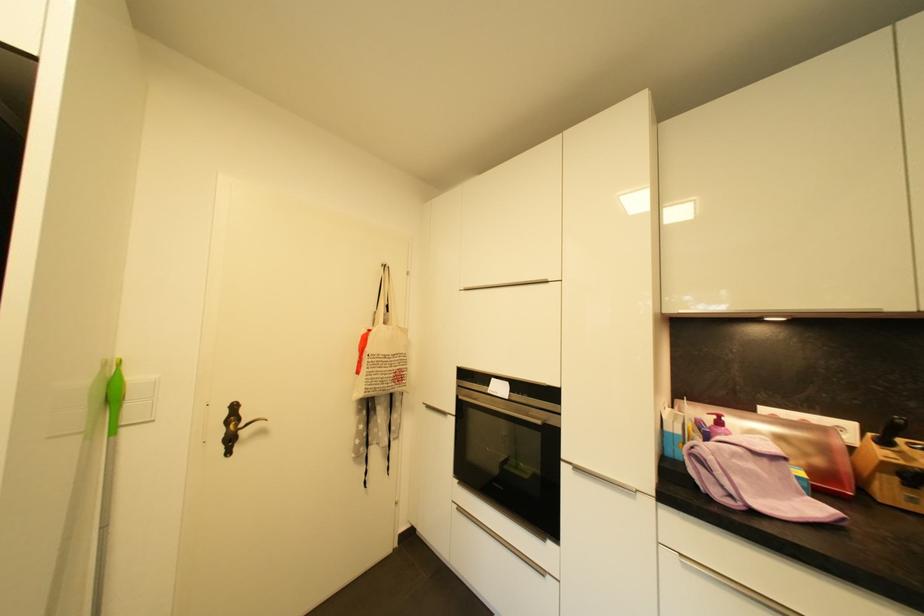
The height and width of the screenshot is (616, 924). What do you see at coordinates (139, 402) in the screenshot?
I see `the white light switch` at bounding box center [139, 402].